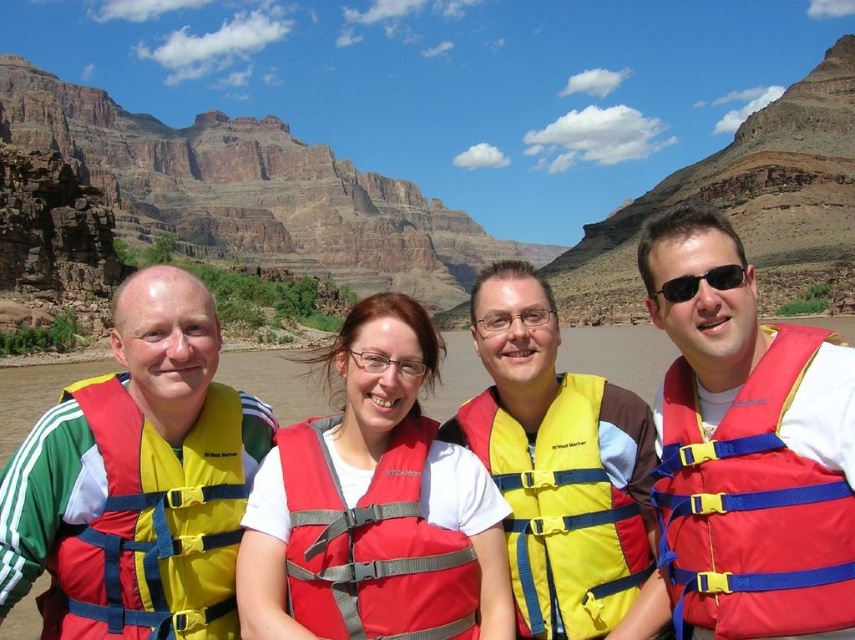
Question: Can you confirm if matte red life vest at center is positioned below sunglasses at right?

Choices:
 (A) yes
 (B) no

Answer: (A)

Question: Is matte red life vest at center smaller than sunglasses at right?

Choices:
 (A) no
 (B) yes

Answer: (A)

Question: Which point is farther from the camera taking this photo?

Choices:
 (A) (561, 540)
 (B) (429, 570)
 (C) (122, 449)
 (D) (467, 520)

Answer: (A)

Question: In this image, where is matte red life vest at center located relative to yellow fabric life jacket at center?

Choices:
 (A) above
 (B) below

Answer: (A)

Question: Based on their relative distances, which object is nearer to the matte red life jacket at center?

Choices:
 (A) matte yellow life jacket at left
 (B) yellow fabric life jacket at center

Answer: (A)

Question: Which point is closer to the camera taking this photo?

Choices:
 (A) (66, 561)
 (B) (732, 262)
 (C) (335, 426)
 (D) (376, 532)

Answer: (A)